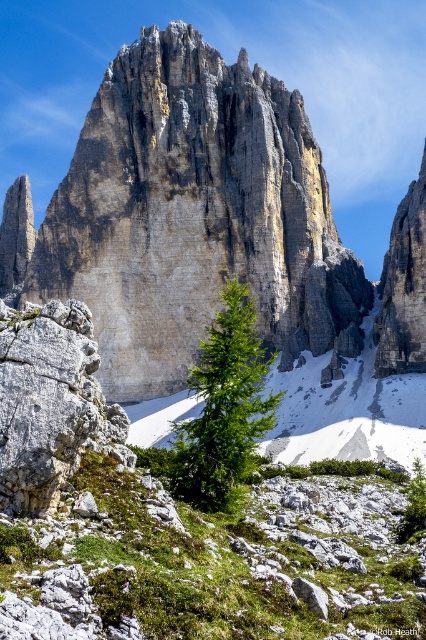
You are a hiker who wants to take a photo of the green matte tree at center. You are currently standing at the gray rough rock at lower left. Which direction should you move to get a better view of the tree?

Since the gray rough rock at lower left is to the left of the green matte tree at center, you should move to the right to get a better view of the tree.

You are a hiker planning to take a photo of the gray stone mountain at center. You want to position yourself exactly at the coordinates given in the description. What coordinates should you aim for?

You should aim for the coordinates point at (192,216) to capture the gray stone mountain at center in your photo.